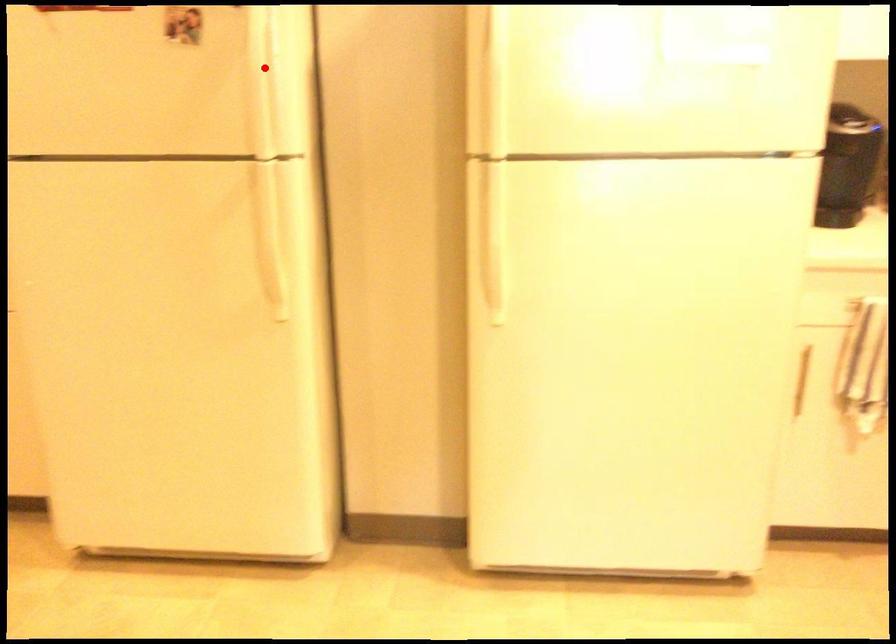
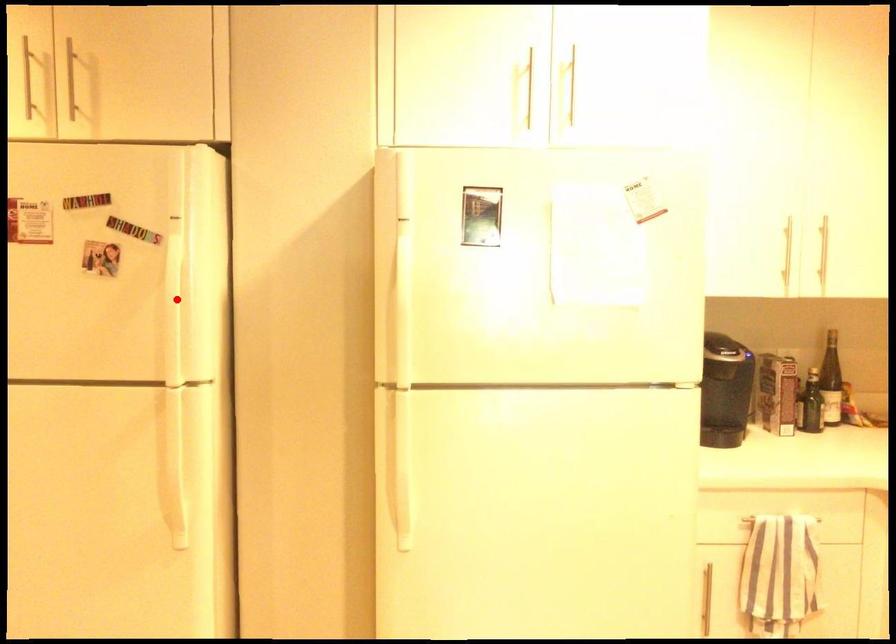
I am providing you with two images of the same scene from different viewpoints. A red point is marked on the first image and another point is marked on the second image. Is the red point in image1 aligned with the point shown in image2?

Yes